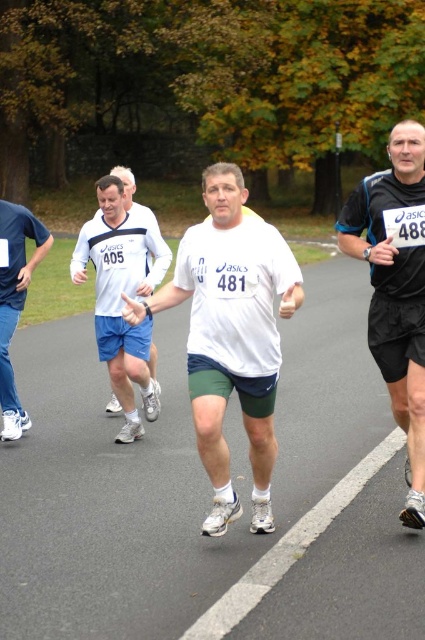
Is point (394, 177) behind point (34, 227)?

That is False.

Can you confirm if black matte running shirt at right is positioned above blue fabric shirt at left?

No, black matte running shirt at right is not above blue fabric shirt at left.

Between point (390, 252) and point (8, 288), which one is positioned behind?

The point (8, 288) is more distant.

Where is `black matte running shirt at right`? This screenshot has height=640, width=425. black matte running shirt at right is located at coordinates (396, 289).

Between white matte t-shirt at center and blue fabric shirt at left, which one is positioned lower?

Positioned lower is white matte t-shirt at center.

Is white matte t-shirt at center bigger than blue fabric shirt at left?

Yes, white matte t-shirt at center is bigger than blue fabric shirt at left.

Which is behind, point (243, 392) or point (22, 285)?

The point (22, 285) is more distant.

Where is `white matte t-shirt at center`? The image size is (425, 640). white matte t-shirt at center is located at coordinates (231, 336).

Does white matte t-shirt at center have a greater width compared to white matte shirt at center?

No.

Who is lower down, white matte t-shirt at center or white matte shirt at center?

white matte t-shirt at center

Describe the element at coordinates (231, 336) in the screenshot. The height and width of the screenshot is (640, 425). I see `white matte t-shirt at center` at that location.

The image size is (425, 640). In order to click on white matte t-shirt at center in this screenshot , I will do click(x=231, y=336).